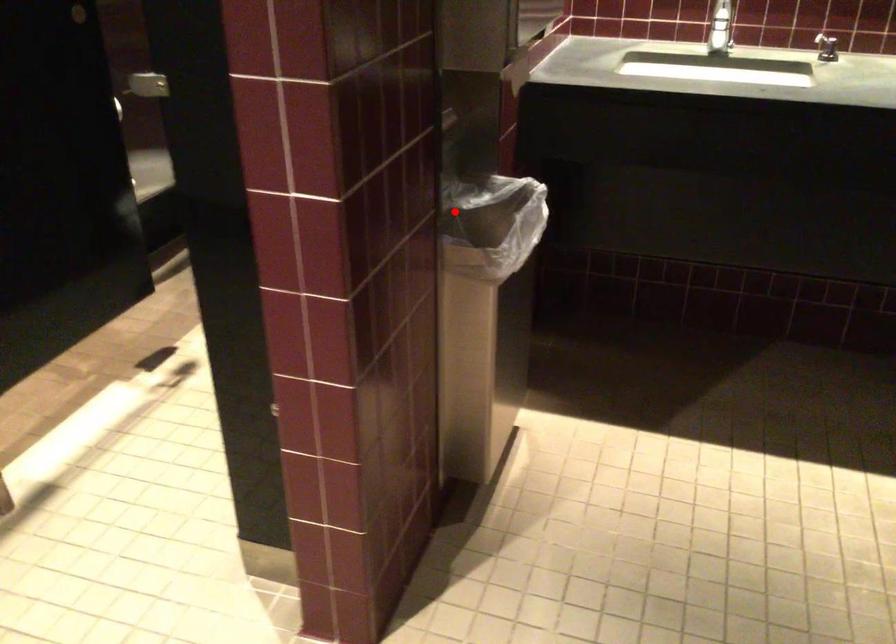
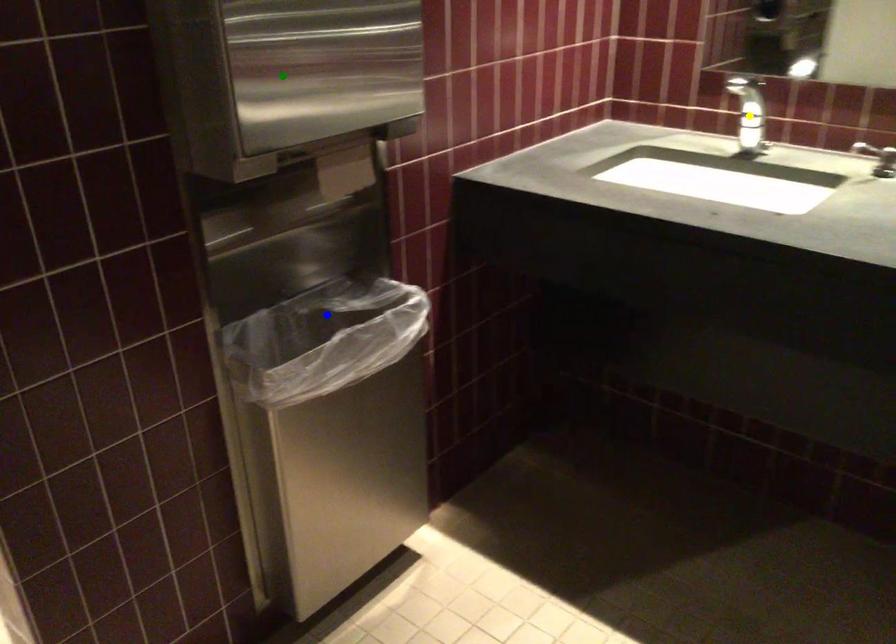
Question: I am providing you with two images of the same scene from different viewpoints. A red point is marked on the first image. You are given multiple points on the second image. Which spot in image 2 lines up with the point in image 1?

Choices:
 (A) yellow point
 (B) green point
 (C) blue point

Answer: (C)